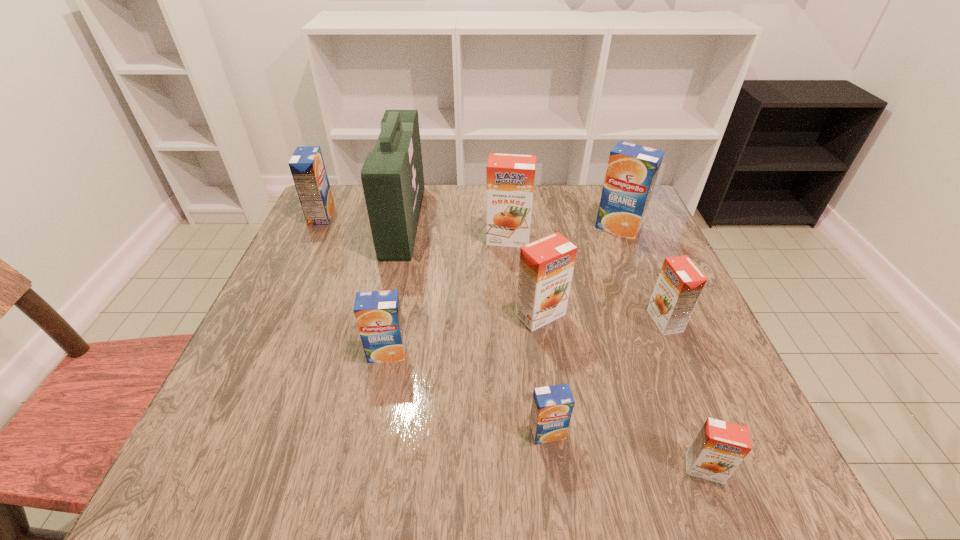
Locate an element on the screen. This screenshot has height=540, width=960. the eighth farthest object is located at coordinates (552, 406).

In order to click on the smallest orange orange juice in this screenshot , I will do `click(718, 449)`.

Where is `the nearest orange juice`? The width and height of the screenshot is (960, 540). the nearest orange juice is located at coordinates (718, 449).

I want to click on vacant area situated on the front-facing side of the first-aid kit, so click(x=468, y=221).

Locate an element on the screen. This screenshot has height=540, width=960. free space located 0.400m on the left of the farthest orange orange juice is located at coordinates (327, 239).

Identify the location of free point located 0.350m on the left of the rightmost blue orange_juice. Image resolution: width=960 pixels, height=540 pixels. (461, 228).

Locate an element on the screen. This screenshot has width=960, height=540. vacant position located on the front of the second biggest blue orange_juice is located at coordinates pyautogui.click(x=290, y=282).

The width and height of the screenshot is (960, 540). In order to click on free space located on the left of the third smallest orange orange juice in this screenshot , I will do 387,315.

The width and height of the screenshot is (960, 540). Find the location of `vacant space situated 0.090m on the right of the third farthest blue orange_juice`. vacant space situated 0.090m on the right of the third farthest blue orange_juice is located at coordinates (453, 353).

Identify the location of vacant space situated 0.330m on the back of the third biggest orange orange juice. The image size is (960, 540). (622, 219).